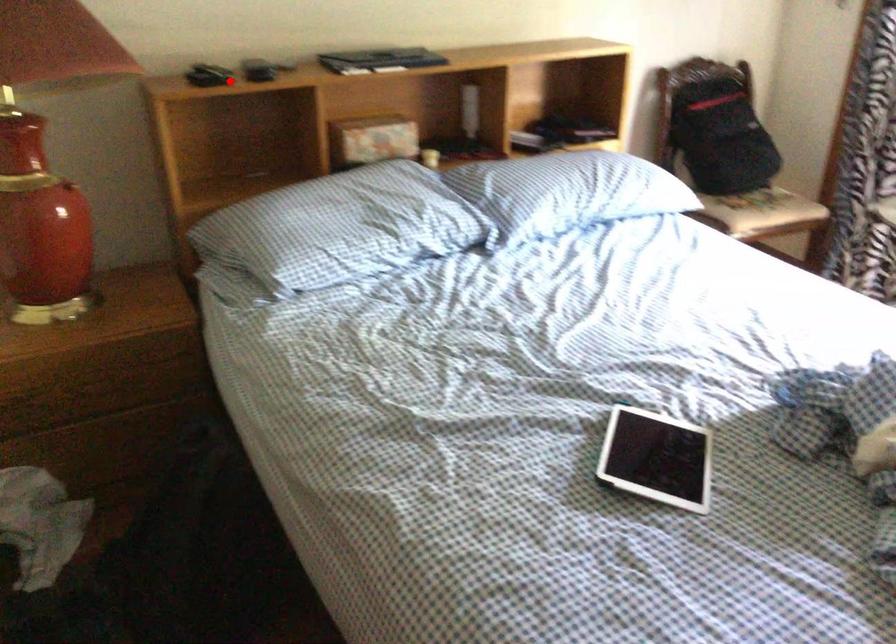
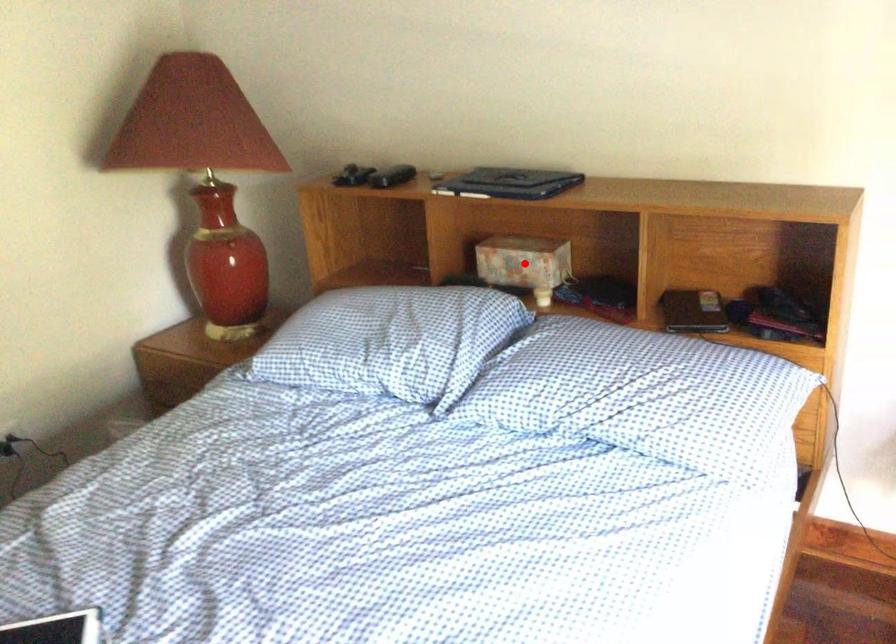
I am providing you with two images of the same scene from different viewpoints. A red point is marked on the first image and another point is marked on the second image. Are the points marked in image1 and image2 representing the same 3D position?

No